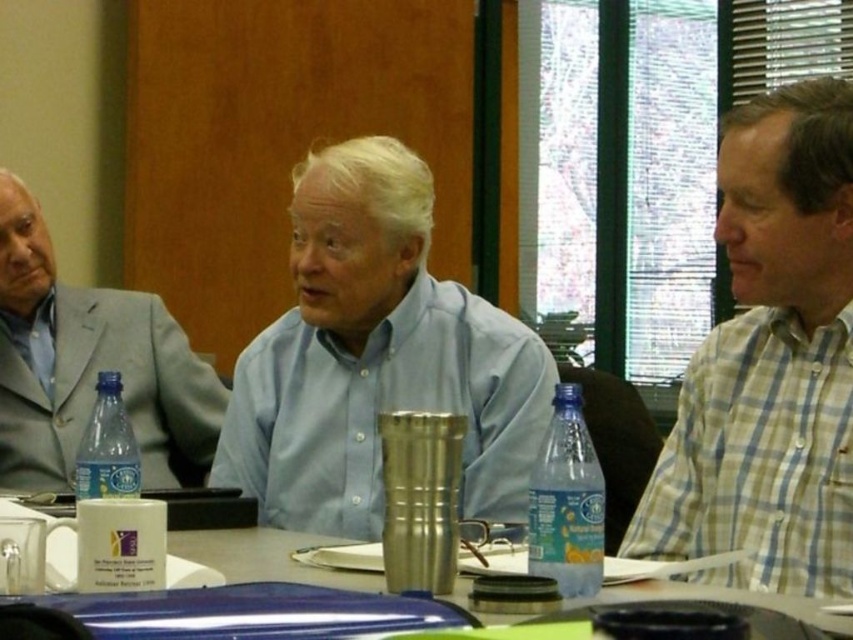
Question: Which point is farther from the camera taking this photo?

Choices:
 (A) (146, 294)
 (B) (122, 419)
 (C) (380, 157)

Answer: (A)

Question: Which point appears closest to the camera in this image?

Choices:
 (A) (656, 564)
 (B) (119, 481)
 (C) (26, 461)

Answer: (A)

Question: Can you confirm if matte blue shirt at center is smaller than blue plastic bottle at center?

Choices:
 (A) yes
 (B) no

Answer: (B)

Question: Which point is farther from the camera taking this photo?

Choices:
 (A) (82, 496)
 (B) (508, 390)
 (C) (86, 372)

Answer: (C)

Question: Considering the relative positions of metallic blue laptop at center and blue plastic bottle at lower left in the image provided, where is metallic blue laptop at center located with respect to blue plastic bottle at lower left?

Choices:
 (A) above
 (B) below

Answer: (B)

Question: Does gray suit jacket at left have a larger size compared to metallic blue laptop at center?

Choices:
 (A) no
 (B) yes

Answer: (B)